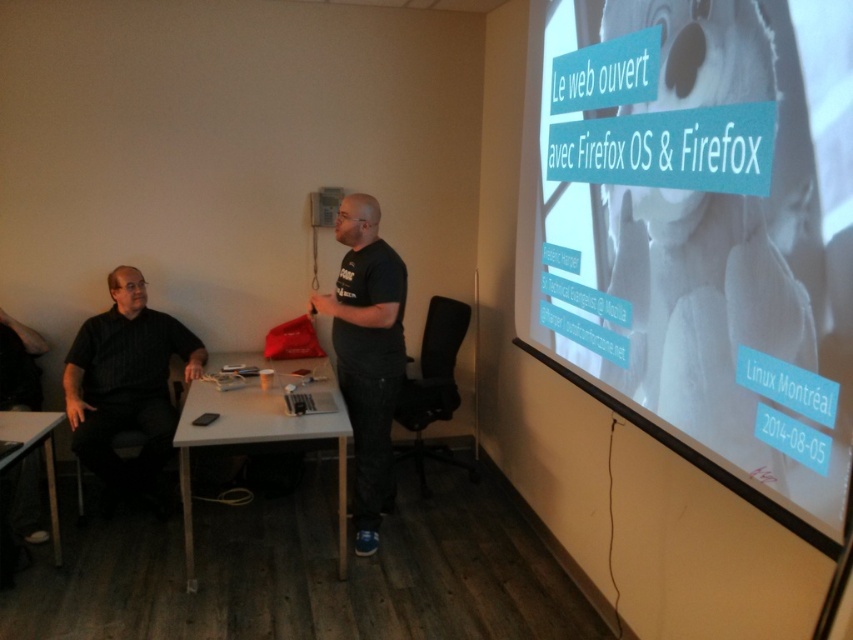
You are a photographer taking a picture of the presentation. You notice the black matte shirt at left and the white plastic table at center. Which object is blocking the view of the other?

The black matte shirt at left is positioned over the white plastic table at center, so it is blocking the view of the white plastic table at center.

You are a photographer positioned in front of the white plastic table at center and the black matte shirt at left. You want to take a photo of the screen. Which object should you adjust your focus on first to ensure both are in frame?

The black matte shirt at left is taller than the white plastic table at center, so you should adjust your focus on the black matte shirt at left first to ensure both are in frame.

You are an event organizer who needs to set up a new screen for an upcoming presentation. The current screen is the white matte projection screen at upper right, and there is a black matte shirt at left. Which object has a smaller width?

The white matte projection screen at upper right has a lesser width compared to the black matte shirt at left, so the white matte projection screen at upper right is smaller in width.